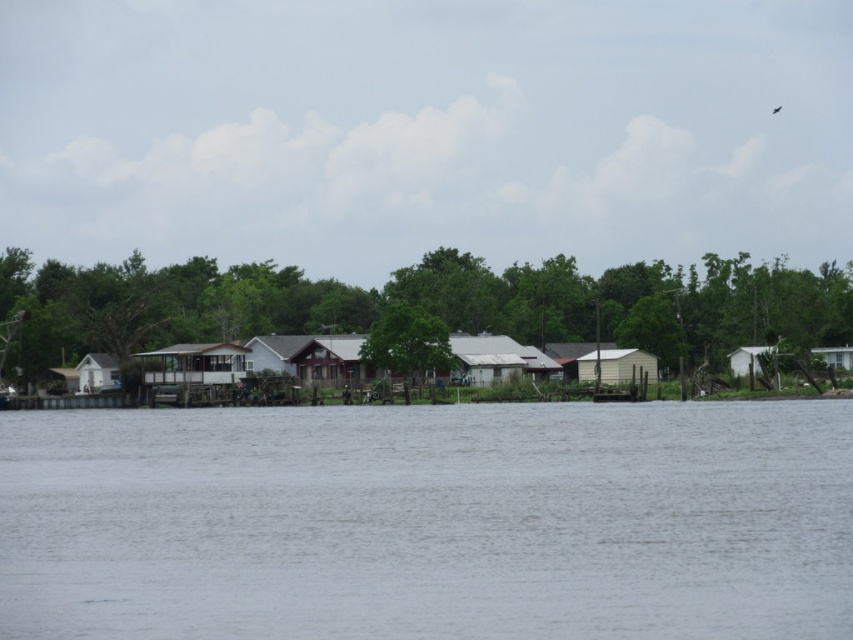
Question: Estimate the real-world distances between objects in this image. Which object is farther from the metallic silver shed at center-right?

Choices:
 (A) green matte tree at center
 (B) white matte hut at right
 (C) gray water at center

Answer: (C)

Question: Where is white wooden hut at center located in relation to metallic silver shed at center-right in the image?

Choices:
 (A) left
 (B) right

Answer: (A)

Question: Where is gray water at center located in relation to white wood house at center in the image?

Choices:
 (A) left
 (B) right

Answer: (B)

Question: Which point is farther from the camera taking this photo?

Choices:
 (A) (398, 348)
 (B) (593, 378)
 (C) (195, 435)
 (D) (732, 364)

Answer: (D)

Question: Considering the relative positions of green matte tree at center and white wood house at center in the image provided, where is green matte tree at center located with respect to white wood house at center?

Choices:
 (A) below
 (B) above

Answer: (B)

Question: Which point is closer to the camera?

Choices:
 (A) (259, 371)
 (B) (608, 364)
 (C) (367, 356)

Answer: (C)